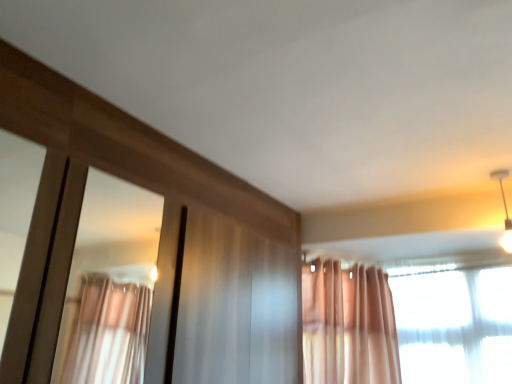
Question: Is white glossy light fixture at upper right at the right side of translucent fabric curtain at upper right?

Choices:
 (A) yes
 (B) no

Answer: (A)

Question: Is white glossy light fixture at upper right oriented away from translucent fabric curtain at upper right?

Choices:
 (A) yes
 (B) no

Answer: (A)

Question: Is white glossy light fixture at upper right not inside translucent fabric curtain at upper right?

Choices:
 (A) yes
 (B) no

Answer: (A)

Question: Is white glossy light fixture at upper right smaller than translucent fabric curtain at upper right?

Choices:
 (A) no
 (B) yes

Answer: (B)

Question: From a real-world perspective, is white glossy light fixture at upper right positioned over translucent fabric curtain at upper right based on gravity?

Choices:
 (A) no
 (B) yes

Answer: (B)

Question: Can you confirm if white glossy light fixture at upper right is taller than translucent fabric curtain at upper right?

Choices:
 (A) yes
 (B) no

Answer: (B)

Question: Is translucent fabric curtain at upper right not close to white glossy light fixture at upper right?

Choices:
 (A) yes
 (B) no

Answer: (B)

Question: Can you confirm if translucent fabric curtain at upper right is positioned to the left of white glossy light fixture at upper right?

Choices:
 (A) no
 (B) yes

Answer: (B)

Question: From the image's perspective, is translucent fabric curtain at upper right below white glossy light fixture at upper right?

Choices:
 (A) yes
 (B) no

Answer: (A)

Question: Considering the relative sizes of translucent fabric curtain at upper right and white glossy light fixture at upper right in the image provided, is translucent fabric curtain at upper right smaller than white glossy light fixture at upper right?

Choices:
 (A) yes
 (B) no

Answer: (B)

Question: Is translucent fabric curtain at upper right not inside white glossy light fixture at upper right?

Choices:
 (A) yes
 (B) no

Answer: (A)

Question: Does translucent fabric curtain at upper right have a lesser width compared to white glossy light fixture at upper right?

Choices:
 (A) yes
 (B) no

Answer: (A)

Question: Considering the positions of point (333, 331) and point (509, 236), is point (333, 331) closer or farther from the camera than point (509, 236)?

Choices:
 (A) farther
 (B) closer

Answer: (A)